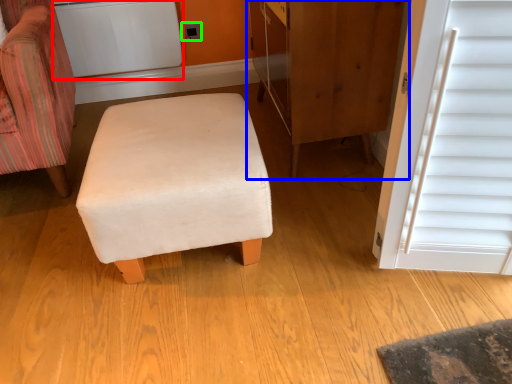
Question: Which object is the closest to the appliance (highlighted by a red box)? Choose among these: dresser (highlighted by a blue box) or electric outlet (highlighted by a green box).

Choices:
 (A) dresser
 (B) electric outlet

Answer: (B)